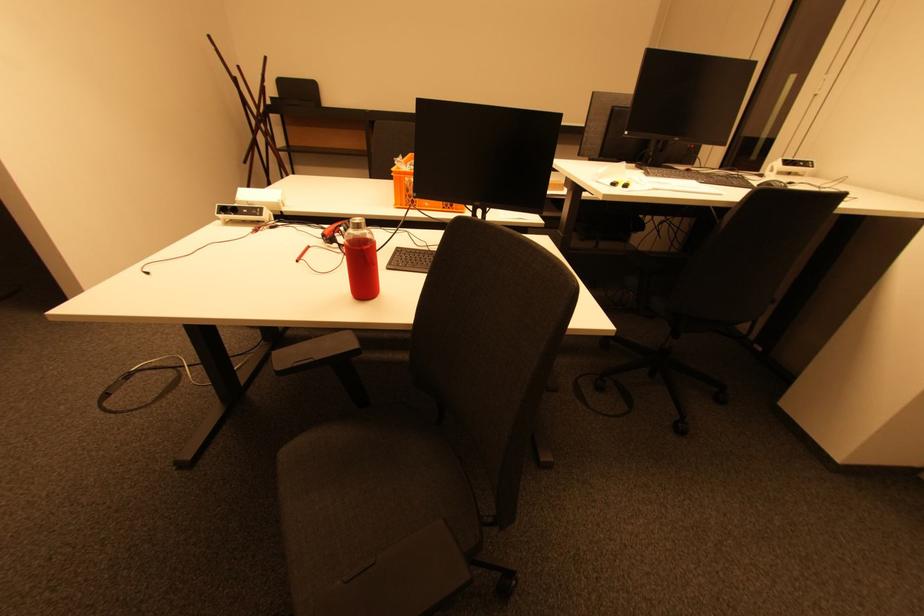
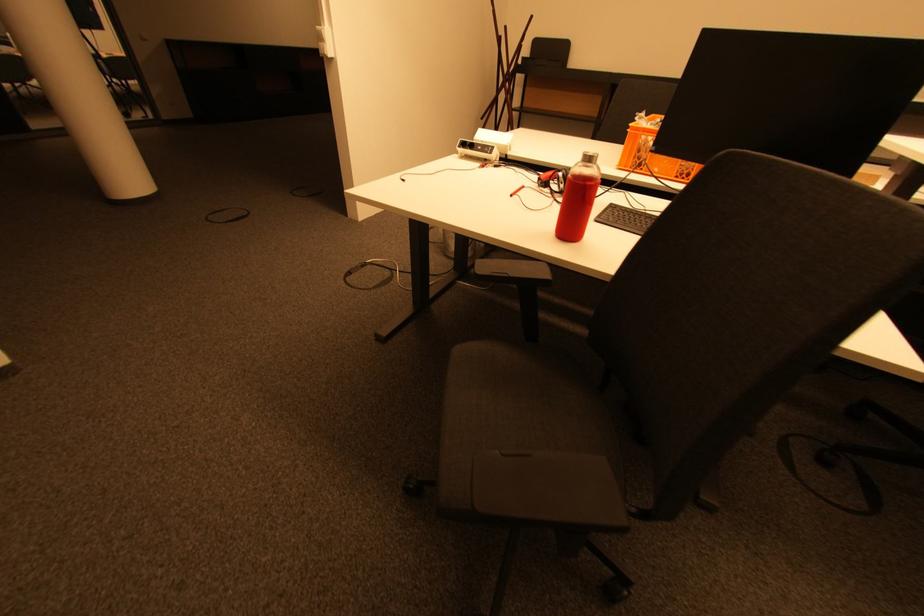
Question: Based on the continuous images, in which direction is the camera rotating? Reply with the corresponding letter.

Choices:
 (A) Left
 (B) Right
 (C) Up
 (D) Down

Answer: (A)